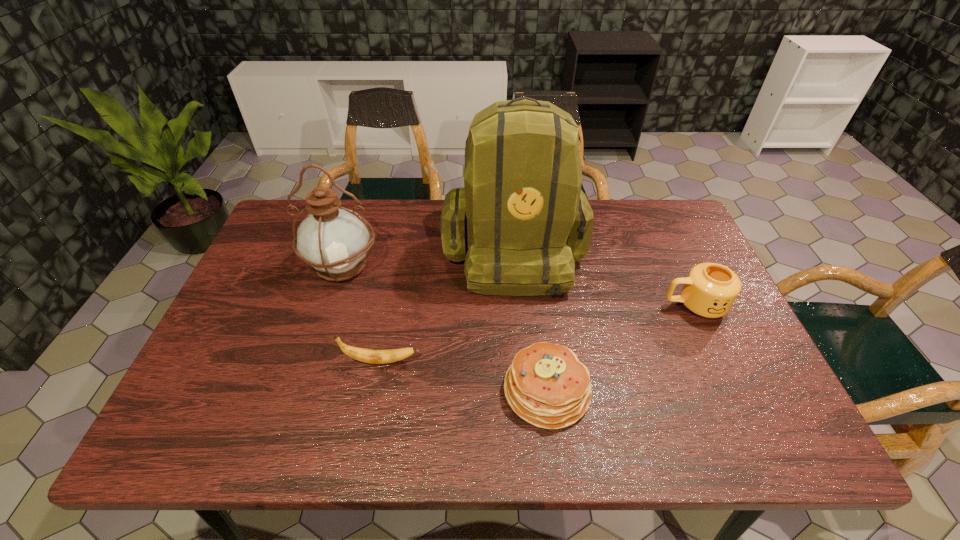
At what (x,y) coordinates should I click in order to perform the action: click on the tallest object. Please return your answer as a coordinate pair (x, y). Looking at the image, I should click on (527, 221).

Where is `the fourth shortest object`? The image size is (960, 540). the fourth shortest object is located at coordinates (334, 240).

Locate an element on the screen. Image resolution: width=960 pixels, height=540 pixels. the rightmost object is located at coordinates (710, 289).

At what (x,y) coordinates should I click in order to perform the action: click on mug. Please return your answer as a coordinate pair (x, y). The height and width of the screenshot is (540, 960). Looking at the image, I should click on (710, 289).

Find the location of a particular element. Image resolution: width=960 pixels, height=540 pixels. banana is located at coordinates (371, 356).

The image size is (960, 540). What are the coordinates of `pancake` in the screenshot? It's located at (546, 385).

Where is `free space located 0.330m on the front-facing side of the tallest object`? The image size is (960, 540). free space located 0.330m on the front-facing side of the tallest object is located at coordinates (527, 417).

Image resolution: width=960 pixels, height=540 pixels. What are the coordinates of `blank space located 0.140m on the right of the second tallest object` in the screenshot? It's located at (429, 266).

Where is `blank space located 0.260m on the handle side of the third tallest object`? The width and height of the screenshot is (960, 540). blank space located 0.260m on the handle side of the third tallest object is located at coordinates (564, 305).

Identify the location of vacant space located on the handle side of the third tallest object. Image resolution: width=960 pixels, height=540 pixels. click(567, 305).